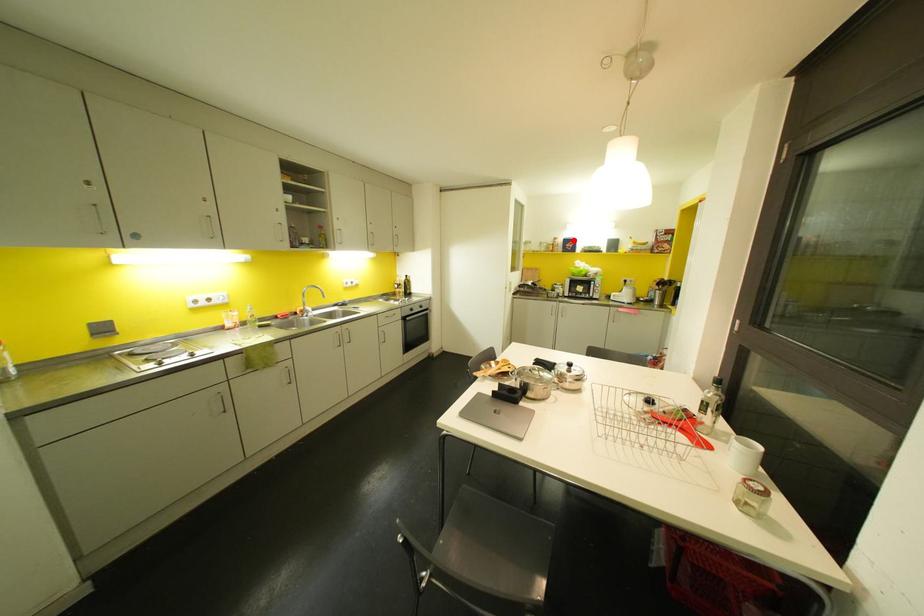
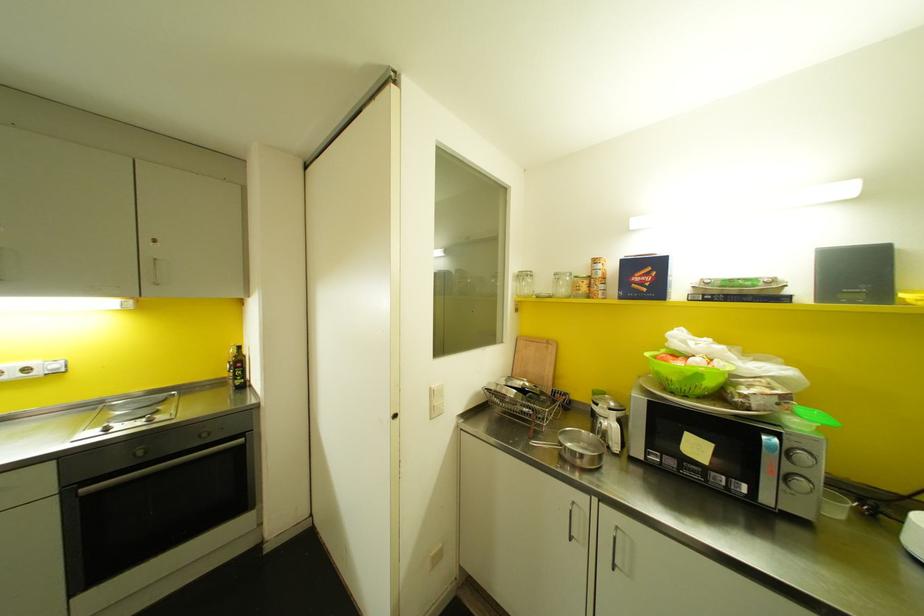
Where in the second image is the point corresponding to the highlighted location from the first image?

(659, 264)